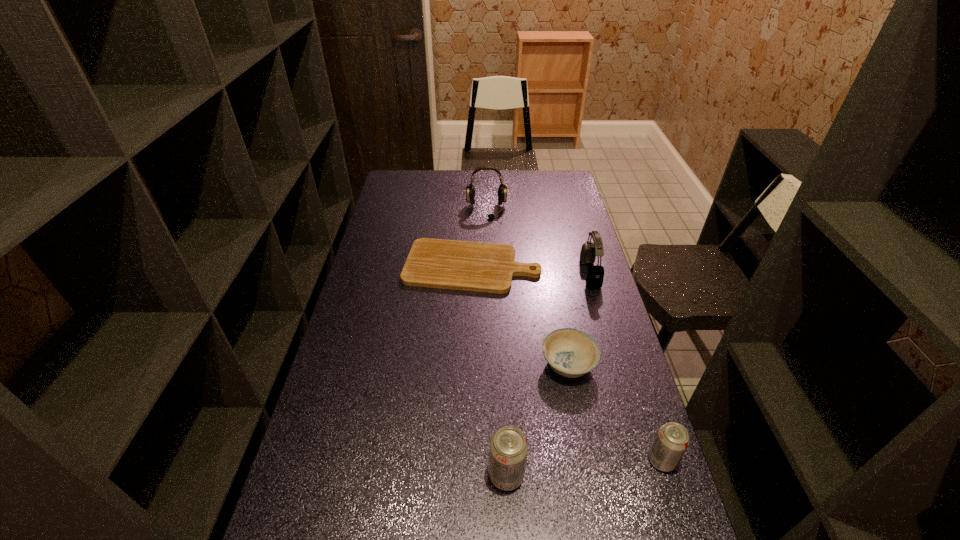
Identify the location of unoccupied area between the left soda can and the second shortest object. This screenshot has width=960, height=540. (538, 420).

I want to click on vacant space that's between the shorter soda can and the taller soda can, so click(x=584, y=468).

Locate an element on the screen. empty space that is in between the right soda can and the right headset is located at coordinates [x=626, y=367].

You are a GUI agent. You are given a task and a screenshot of the screen. Output one action in this format:
    pyautogui.click(x=<x>, y=<y>)
    Task: Click on the empty location between the fourth tallest object and the nearer headset
    Image resolution: width=960 pixels, height=540 pixels.
    Given the screenshot: What is the action you would take?
    pyautogui.click(x=626, y=367)

Identify the location of vacant space that is in between the chopping board and the left headset. The height and width of the screenshot is (540, 960). (479, 238).

Find the location of a particular element. the fourth closest object to the nearer headset is located at coordinates (672, 440).

Select which object is the closest to the fifth tallest object. Please provide its 2D coordinates. Your answer should be formatted as a tuple, i.e. [(x, y)], where the tuple contains the x and y coordinates of a point satisfying the conditions above.

[(672, 440)]

You are a GUI agent. You are given a task and a screenshot of the screen. Output one action in this format:
    pyautogui.click(x=<x>, y=<y>)
    Task: Click on the free point that satisfies the following two spatial constraints: 1. with the microphone on the side of the second shortest object; 2. on the right side of the left headset
    This screenshot has height=540, width=960.
    Given the screenshot: What is the action you would take?
    coord(490,364)

This screenshot has width=960, height=540. I want to click on blank area in the image that satisfies the following two spatial constraints: 1. with the microphone on the side of the left headset; 2. on the right side of the fourth farthest object, so click(x=490, y=364).

The height and width of the screenshot is (540, 960). Find the location of `free space that satisfies the following two spatial constraints: 1. on the front side of the left soda can; 2. on the left side of the shortest object`. free space that satisfies the following two spatial constraints: 1. on the front side of the left soda can; 2. on the left side of the shortest object is located at coordinates (468, 475).